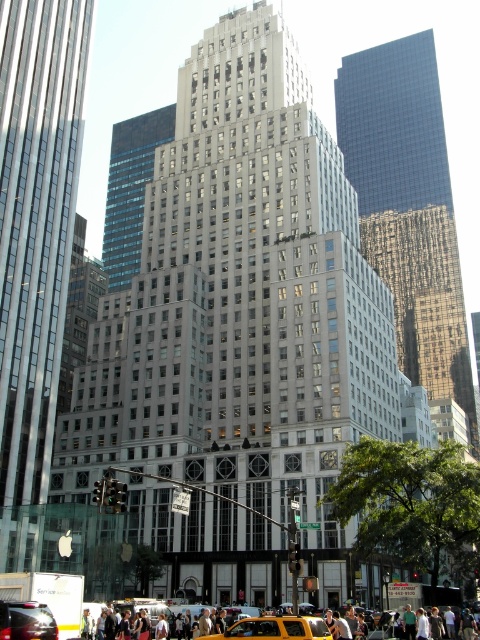
Question: Is yellow matte taxi at center positioned before shiny black car at lower left?

Choices:
 (A) no
 (B) yes

Answer: (B)

Question: Is yellow matte taxi at center below shiny black car at lower left?

Choices:
 (A) no
 (B) yes

Answer: (B)

Question: Which of the following is the farthest from the observer?

Choices:
 (A) shiny black car at lower left
 (B) yellow matte taxi at center

Answer: (A)

Question: From the image, what is the correct spatial relationship of yellow matte taxi at center in relation to shiny black car at lower left?

Choices:
 (A) left
 (B) right

Answer: (B)

Question: Which object is farther from the camera taking this photo?

Choices:
 (A) shiny black car at lower left
 (B) yellow matte taxi at center

Answer: (A)